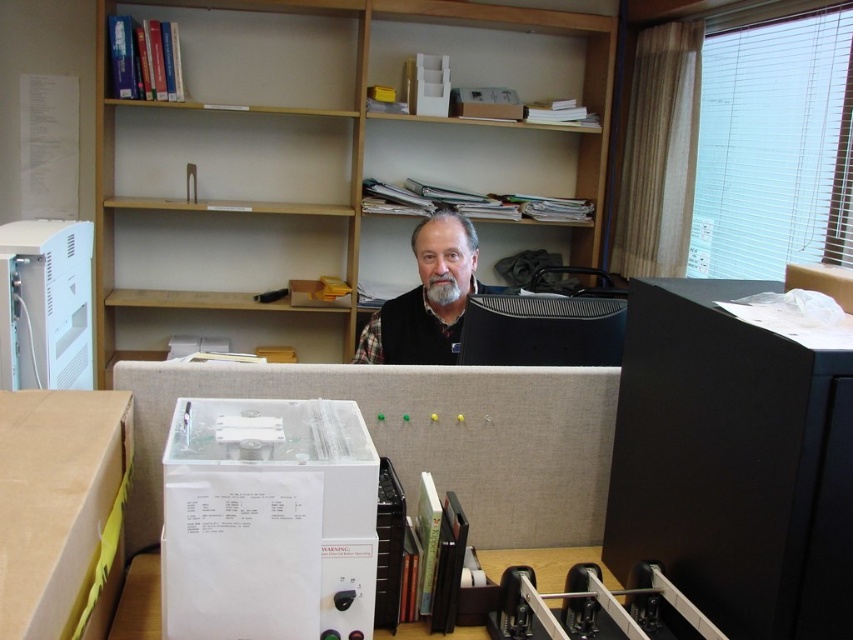
Question: Does light wood bookshelf at upper center appear on the right side of white plastic computer at left?

Choices:
 (A) no
 (B) yes

Answer: (B)

Question: Which is farther from the white plastic table at center?

Choices:
 (A) white plastic box at center
 (B) black plastic file cabinet at right
 (C) white plastic box at lower left

Answer: (C)

Question: Among these points, which one is nearest to the camera?

Choices:
 (A) (410, 337)
 (B) (291, 417)
 (C) (18, 225)
 (D) (392, 637)

Answer: (B)

Question: Is white plastic computer at left below gray knit sweater at center?

Choices:
 (A) no
 (B) yes

Answer: (B)

Question: Which point is farther to the camera?

Choices:
 (A) gray knit sweater at center
 (B) light wood bookshelf at upper center

Answer: (B)

Question: Is white plastic box at center further to camera compared to white plastic computer at left?

Choices:
 (A) no
 (B) yes

Answer: (A)